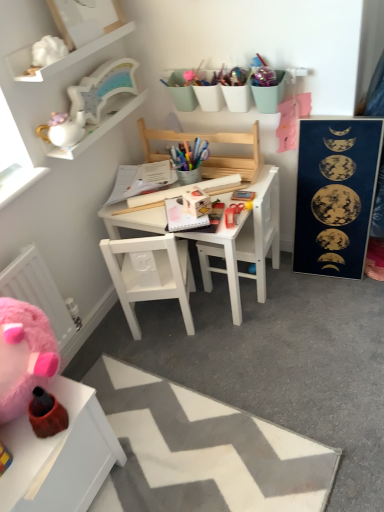
Find the location of a particular element. vacant space that is in between white matte chair at center, acting as the 2th chair starting from the top, and white wooden table at center, which is counted as the 1th table, starting from the back is located at coordinates 200,329.